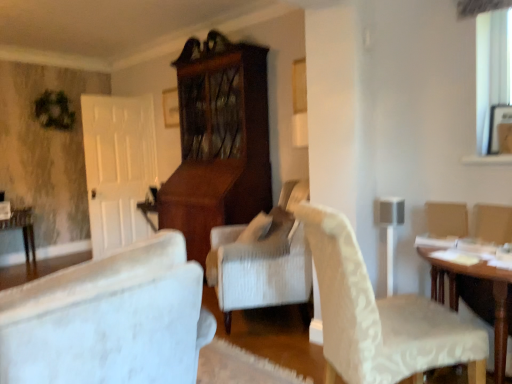
In order to click on wooden table at lower left, arranged as the second table when viewed from the right in this screenshot , I will do `click(23, 233)`.

What are the coordinates of `wooden table at right, the first table when ordered from front to back` in the screenshot? It's located at (458, 297).

You are a GUI agent. You are given a task and a screenshot of the screen. Output one action in this format:
    pyautogui.click(x=<x>, y=<y>)
    Task: Click on the white textured chair at center-right
    
    Given the screenshot: What is the action you would take?
    pyautogui.click(x=380, y=315)

The height and width of the screenshot is (384, 512). Find the location of `wooden table at lower left, placed as the 1th table when sorted from back to front`. wooden table at lower left, placed as the 1th table when sorted from back to front is located at coordinates (23, 233).

In the scene shown: Considering the positions of objects wooden table at lower left, placed as the 1th table when sorted from back to front, and white textured chair at center-right in the image provided, who is more to the left, wooden table at lower left, placed as the 1th table when sorted from back to front, or white textured chair at center-right?

wooden table at lower left, placed as the 1th table when sorted from back to front, is more to the left.

Measure the distance from wooden table at lower left, which is counted as the 1th table, starting from the left, to white textured chair at center-right.

wooden table at lower left, which is counted as the 1th table, starting from the left, and white textured chair at center-right are 4.54 meters apart from each other.

Considering the relative sizes of wooden table at lower left, marked as the 2th table in a front-to-back arrangement, and white textured chair at center-right in the image provided, is wooden table at lower left, marked as the 2th table in a front-to-back arrangement, bigger than white textured chair at center-right?

No, wooden table at lower left, marked as the 2th table in a front-to-back arrangement, is not bigger than white textured chair at center-right.

Which is in front, wooden table at lower left, which is counted as the 1th table, starting from the left, or white textured chair at center-right?

white textured chair at center-right.

Looking at the image, does wooden table at right, which is counted as the first table, starting from the right, seem bigger or smaller compared to wooden table at lower left, placed as the 1th table when sorted from back to front?

Clearly, wooden table at right, which is counted as the first table, starting from the right, is larger in size than wooden table at lower left, placed as the 1th table when sorted from back to front.

Is wooden table at right, the first table when ordered from front to back, positioned beyond the bounds of wooden table at lower left, placed as the 1th table when sorted from back to front?

Yes, wooden table at right, the first table when ordered from front to back, is outside of wooden table at lower left, placed as the 1th table when sorted from back to front.

Considering the sizes of wooden table at right, acting as the second table starting from the back, and wooden table at lower left, marked as the 2th table in a front-to-back arrangement, in the image, is wooden table at right, acting as the second table starting from the back, taller or shorter than wooden table at lower left, marked as the 2th table in a front-to-back arrangement,?

wooden table at right, acting as the second table starting from the back, is taller than wooden table at lower left, marked as the 2th table in a front-to-back arrangement.

Between point (27, 207) and point (429, 248), which one is positioned behind?

The point (27, 207) is farther.

Is the position of wooden table at lower left, marked as the 2th table in a front-to-back arrangement, less distant than that of wooden table at right, acting as the second table starting from the back?

No, it is not.

Where is `table above the wooden table at right, which is counted as the first table, starting from the right (from the image's perspective)`? The width and height of the screenshot is (512, 384). table above the wooden table at right, which is counted as the first table, starting from the right (from the image's perspective) is located at coordinates (23, 233).

From a real-world perspective, is wooden table at lower left, arranged as the second table when viewed from the right, above or below wooden table at right, which is counted as the first table, starting from the right?

wooden table at lower left, arranged as the second table when viewed from the right, is below wooden table at right, which is counted as the first table, starting from the right.

Based on the photo, how distant is white textured chair at center-right from wooden table at lower left, marked as the 2th table in a front-to-back arrangement?

They are 4.54 meters apart.

Is point (344, 330) positioned before point (33, 245)?

Yes, point (344, 330) is closer to viewer.

Is white textured chair at center-right shorter than wooden table at lower left, arranged as the second table when viewed from the right?

Incorrect, the height of white textured chair at center-right does not fall short of that of wooden table at lower left, arranged as the second table when viewed from the right.

Which is more to the left, white textured chair at center-right or wooden table at lower left, which is counted as the 1th table, starting from the left?

From the viewer's perspective, wooden table at lower left, which is counted as the 1th table, starting from the left, appears more on the left side.

Who is taller, wooden table at right, the 2th table positioned from the left, or white textured chair at center-right?

With more height is white textured chair at center-right.

Is wooden table at right, which is counted as the first table, starting from the right, situated inside white textured chair at center-right or outside?

wooden table at right, which is counted as the first table, starting from the right, is spatially situated outside white textured chair at center-right.

From the picture: Which object is closer to the camera, wooden table at right, acting as the second table starting from the back, or white textured chair at center-right?

white textured chair at center-right is more forward.

Does wooden table at right, the first table when ordered from front to back, appear on the left side of white textured chair at center-right?

No.

Between white textured chair at center-right and wooden table at right, the 2th table positioned from the left, which one appears on the right side from the viewer's perspective?

wooden table at right, the 2th table positioned from the left.

Is white textured chair at center-right aimed at wooden table at right, the 2th table positioned from the left?

Yes, white textured chair at center-right is oriented towards wooden table at right, the 2th table positioned from the left.

From the image's perspective, is white textured chair at center-right above or below wooden table at right, the 2th table positioned from the left?

white textured chair at center-right is above wooden table at right, the 2th table positioned from the left.

Can you confirm if white textured chair at center-right is taller than wooden table at right, the first table when ordered from front to back?

Yes.

Locate an element on the screen. The width and height of the screenshot is (512, 384). chair in front of the wooden table at lower left, arranged as the second table when viewed from the right is located at coordinates (380, 315).

Locate an element on the screen. The height and width of the screenshot is (384, 512). table behind the wooden table at right, the 2th table positioned from the left is located at coordinates (23, 233).

When comparing their distances from wooden table at lower left, marked as the 2th table in a front-to-back arrangement, does wooden table at right, acting as the second table starting from the back, or white textured chair at center-right seem further?

wooden table at right, acting as the second table starting from the back, is positioned further to the anchor wooden table at lower left, marked as the 2th table in a front-to-back arrangement.

From the image, which object appears to be nearer to wooden table at right, acting as the second table starting from the back, wooden table at lower left, marked as the 2th table in a front-to-back arrangement, or white textured chair at center-right?

Among the two, white textured chair at center-right is located nearer to wooden table at right, acting as the second table starting from the back.

When comparing their distances from white textured chair at center-right, does wooden table at lower left, marked as the 2th table in a front-to-back arrangement, or wooden table at right, acting as the second table starting from the back, seem further?

wooden table at lower left, marked as the 2th table in a front-to-back arrangement.

Looking at the image, which one is located further to wooden table at right, the first table when ordered from front to back, white textured chair at center-right or wooden table at lower left, arranged as the second table when viewed from the right?

wooden table at lower left, arranged as the second table when viewed from the right.

Based on their spatial positions, is white textured chair at center-right or wooden table at right, the first table when ordered from front to back, further from wooden table at lower left, arranged as the second table when viewed from the right?

wooden table at right, the first table when ordered from front to back, lies further to wooden table at lower left, arranged as the second table when viewed from the right, than the other object.

Consider the image. When comparing their distances from white textured chair at center-right, does wooden table at right, which is counted as the first table, starting from the right, or wooden table at lower left, arranged as the second table when viewed from the right, seem closer?

Among the two, wooden table at right, which is counted as the first table, starting from the right, is located nearer to white textured chair at center-right.

Find the location of a particular element. The image size is (512, 384). chair between wooden table at lower left, marked as the 2th table in a front-to-back arrangement, and wooden table at right, which is counted as the first table, starting from the right, in the horizontal direction is located at coordinates (380, 315).